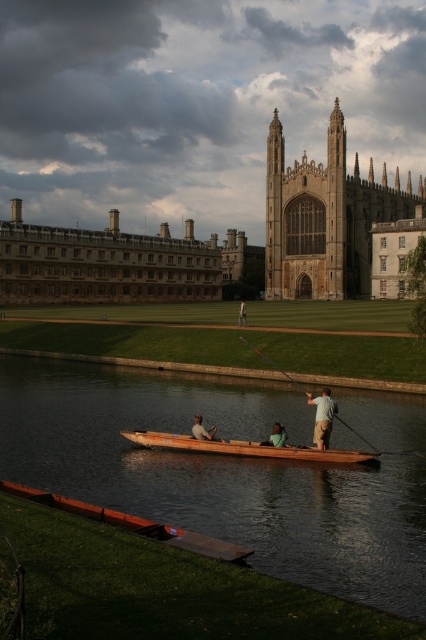
Can you confirm if brown wooden boat at lower center is wider than wooden canoe at center?

Correct, the width of brown wooden boat at lower center exceeds that of wooden canoe at center.

Which is behind, point (37, 461) or point (307, 448)?

Positioned behind is point (37, 461).

This screenshot has width=426, height=640. Describe the element at coordinates (230, 468) in the screenshot. I see `brown wooden boat at lower center` at that location.

Locate an element on the screen. This screenshot has height=640, width=426. brown wooden boat at lower center is located at coordinates (230, 468).

Can you confirm if wooden canoe at center is wider than wooden smooth paddle at center?

Yes, wooden canoe at center is wider than wooden smooth paddle at center.

Does point (245, 451) come farther from viewer compared to point (302, 387)?

No, it is not.

I want to click on wooden canoe at center, so click(x=249, y=449).

Looking at this image, does brown wooden boat at lower center have a greater height compared to light brown wooden paddle boat at center?

Yes, brown wooden boat at lower center is taller than light brown wooden paddle boat at center.

Which is below, brown wooden boat at lower center or light brown wooden paddle boat at center?

light brown wooden paddle boat at center

Between point (362, 580) and point (198, 422), which one is positioned behind?

The point (198, 422) is more distant.

This screenshot has width=426, height=640. I want to click on brown wooden boat at lower center, so click(230, 468).